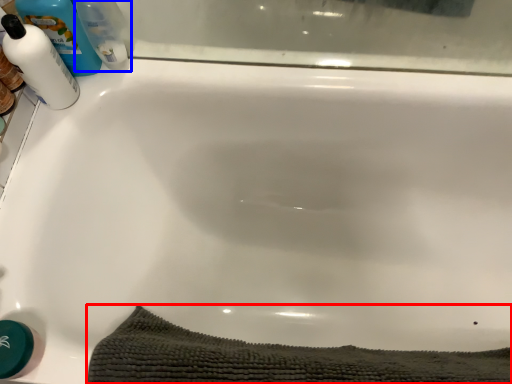
Question: Among these objects, which one is farthest to the camera, bath towel (highlighted by a red box) or cleaning product (highlighted by a blue box)?

Choices:
 (A) bath towel
 (B) cleaning product

Answer: (B)